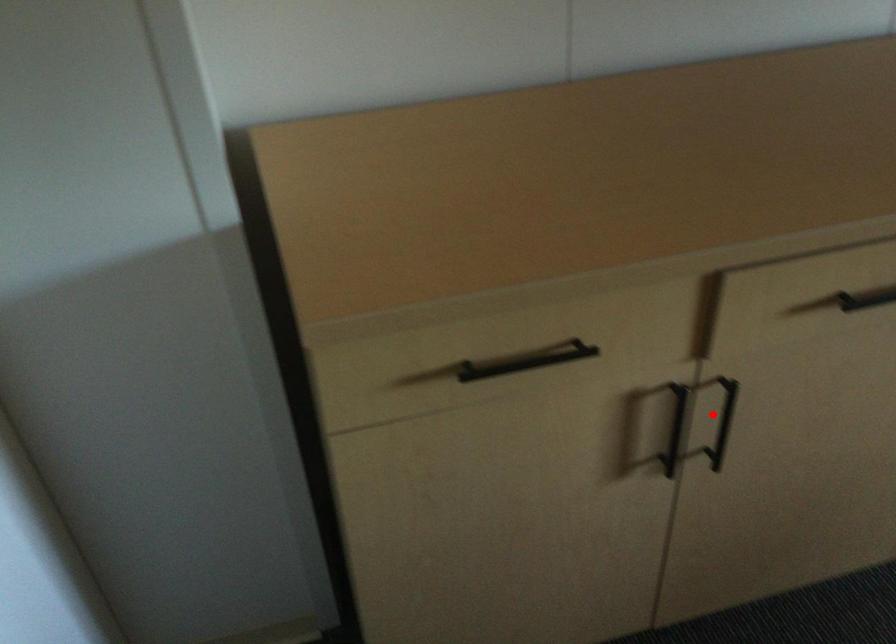
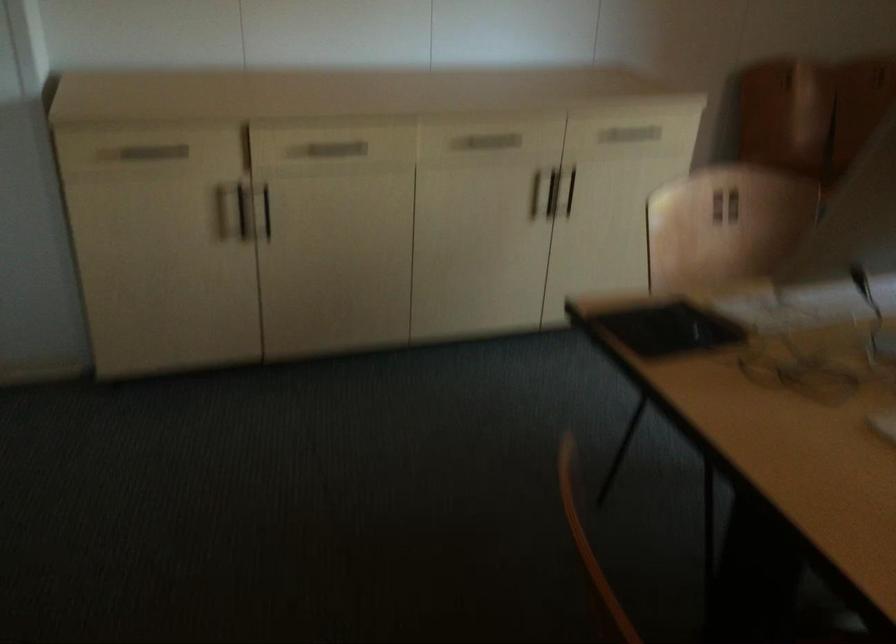
Question: I am providing you with two images of the same scene from different viewpoints. Given a red point in image1, look at the same physical point in image2. Is it:

Choices:
 (A) Closer to the viewpoint
 (B) Farther from the viewpoint

Answer: (B)